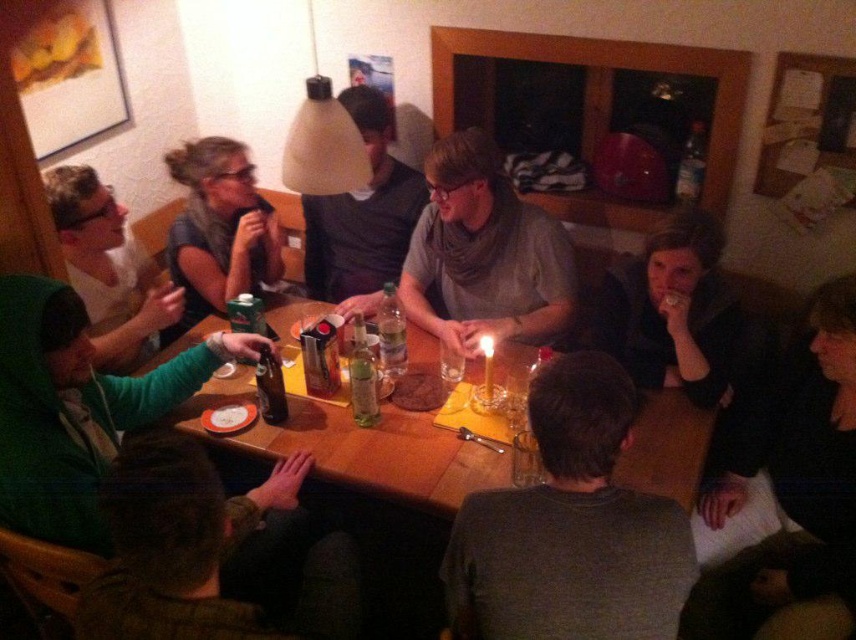
Which is behind, point (557, 595) or point (175, 378)?

The point (175, 378) is more distant.

Can you confirm if dark gray sweater at center is bigger than green hoodie at left?

No.

Which is behind, point (539, 589) or point (140, 404)?

The point (140, 404) is behind.

Locate an element on the screen. The image size is (856, 640). dark gray sweater at center is located at coordinates (569, 528).

Based on the photo, between green hoodie at left and translucent glass bottle at table center, which one is positioned lower?

Positioned lower is green hoodie at left.

Does green hoodie at left appear under translucent glass bottle at table center?

Yes.

Is point (13, 276) more distant than point (377, 394)?

That is False.

This screenshot has width=856, height=640. I want to click on green hoodie at left, so click(76, 410).

Can you confirm if black fabric at lower right is thinner than matte gray shirt at upper left?

Incorrect, black fabric at lower right's width is not less than matte gray shirt at upper left's.

Is black fabric at lower right shorter than matte gray shirt at upper left?

Incorrect, black fabric at lower right's height does not fall short of matte gray shirt at upper left's.

Does point (846, 636) come closer to viewer compared to point (171, 232)?

Yes, point (846, 636) is in front of point (171, 232).

Identify the location of black fabric at lower right. (786, 497).